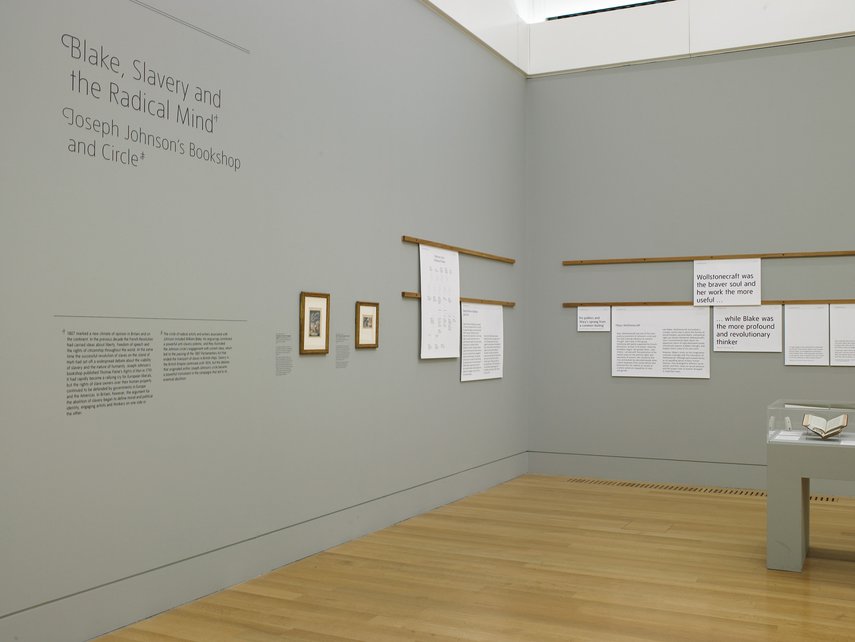
Where is `1 leg table`? This screenshot has height=642, width=855. 1 leg table is located at coordinates (799, 474).